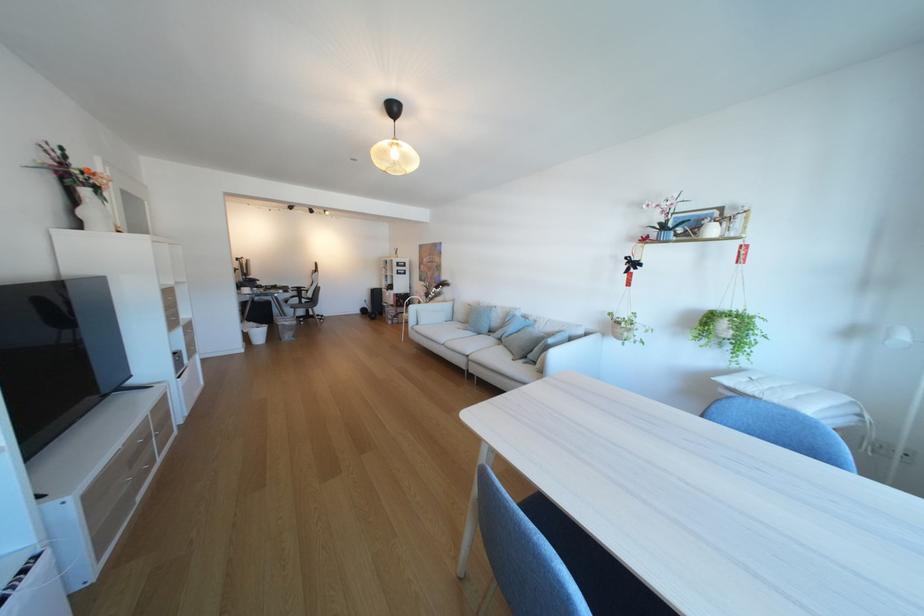
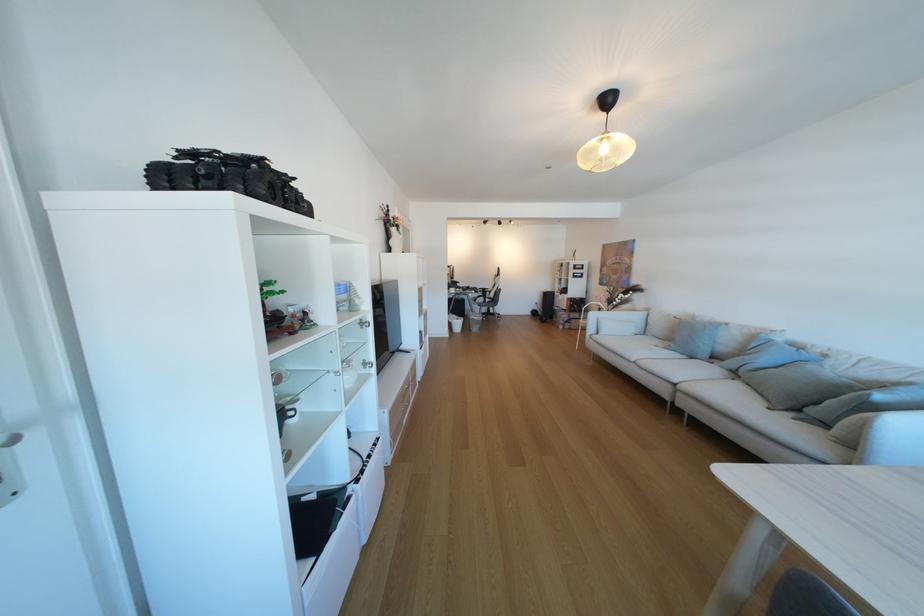
Find the pixel in the second image that matches (x=270, y=329) in the first image.

(468, 321)